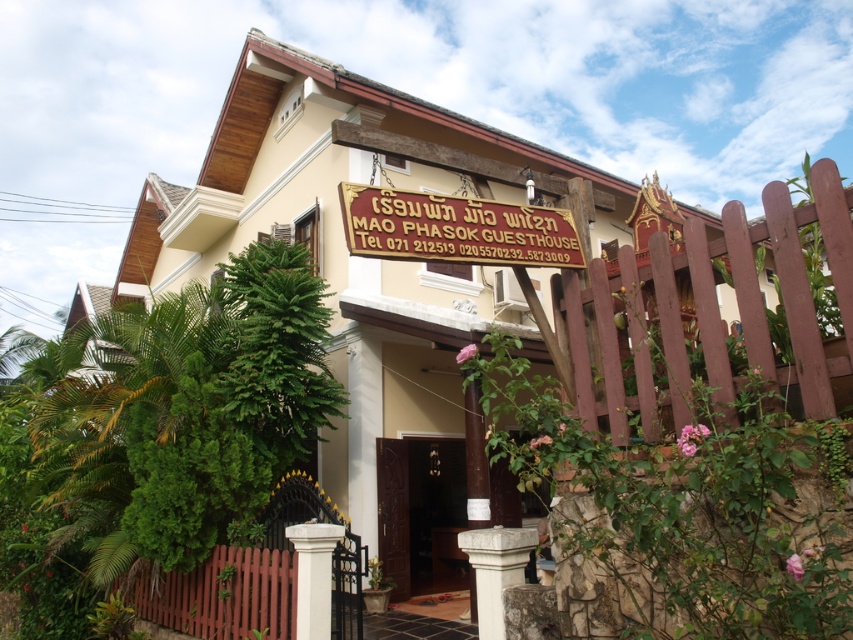
You are a delivery person trying to enter the Mao Phasok Guesthouse. You see the brown wooden fence at lower left and the dark wood door at center. Which object is wider?

The brown wooden fence at lower left is wider than the dark wood door at center.

You are standing in front of the Mao Phasok Guesthouse and want to enter through the entrance. Which object, the brown wooden fence at lower left or the gold wood signboard at center, is closer to you as you approach the entrance?

The brown wooden fence at lower left is closer to you because it is further to the viewer than the gold wood signboard at center, meaning it appears nearer in your line of sight when approaching the entrance.

You are standing at the entrance of Mao Phasok Guesthouse and want to locate two specific points marked on the building facade. The first point is at coordinate point (270, 531) and the second is at point (410, 500). From your perspective at the entrance, which point is closer to you?

Point (270, 531) is in front of point (410, 500), so the first point is closer to you.